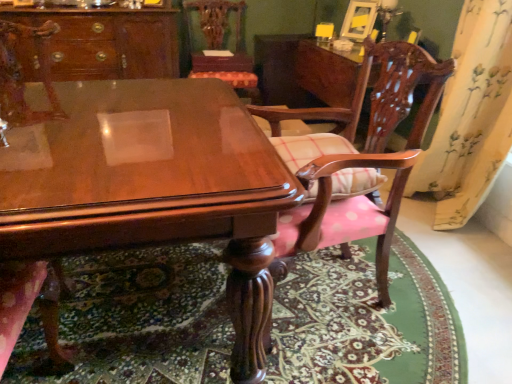
Question: Is point (451, 302) positioned closer to the camera than point (261, 155)?

Choices:
 (A) farther
 (B) closer

Answer: (A)

Question: Based on their sizes in the image, would you say carpeted floor at lower center is bigger or smaller than glossy wood table at center?

Choices:
 (A) small
 (B) big

Answer: (A)

Question: Considering the real-world distances, which object is farthest from the glossy wood table at center?

Choices:
 (A) wooden chair with cushion at center, the second chair in the back-to-front sequence
 (B) polished wood chair at lower left, which is the third chair in back-to-front order
 (C) wooden chair at upper center, the third chair in the front-to-back sequence
 (D) carpeted floor at lower center
 (E) glossy wood cabinet at upper left

Answer: (C)

Question: Estimate the real-world distances between objects in this image. Which object is farther from the polished wood chair at lower left, marked as the first chair in a front-to-back arrangement?

Choices:
 (A) carpeted floor at lower center
 (B) yellow floral fabric at right
 (C) glossy wood cabinet at upper left
 (D) wooden chair at upper center, the 1th chair from the back
 (E) glossy wood table at center

Answer: (B)